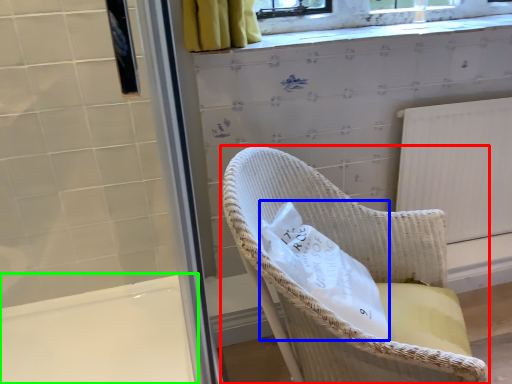
Question: Estimate the real-world distances between objects in this image. Which object is closer to chair (highlighted by a red box), material (highlighted by a blue box) or bath (highlighted by a green box)?

Choices:
 (A) material
 (B) bath

Answer: (A)